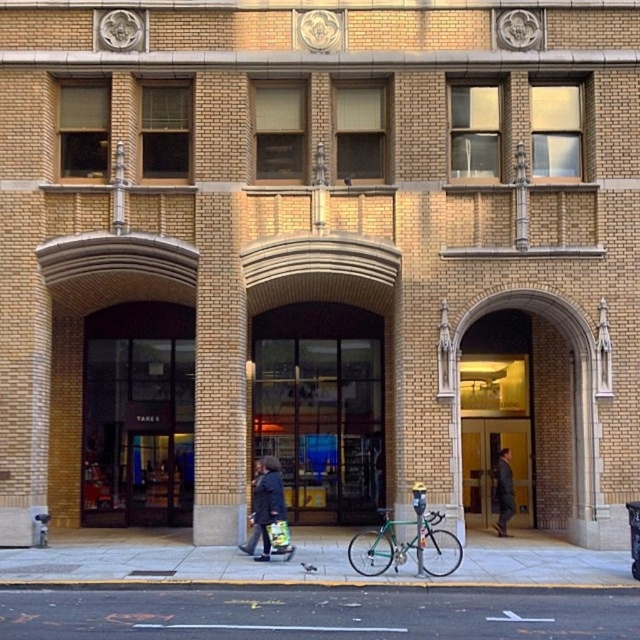
You are a delivery person trying to park your 2.5 meter wide delivery van. You see the gray asphalt at lower center and the smooth concrete sidewalk at center. Which surface can accommodate your van?

The smooth concrete sidewalk at center has a greater width than the gray asphalt at lower center, so the van can park on the smooth concrete sidewalk at center since it is wider than 2.5 meters.

You are a delivery person trying to park your green metallic bicycle at center next to the dark gray coat at center in the building facade. Given that the space between the two objects is narrow, can the bicycle fit without overlapping the coat?

The green metallic bicycle at center is wider than the dark gray coat at center, so it may not fit in the narrow space between them without overlapping the coat.